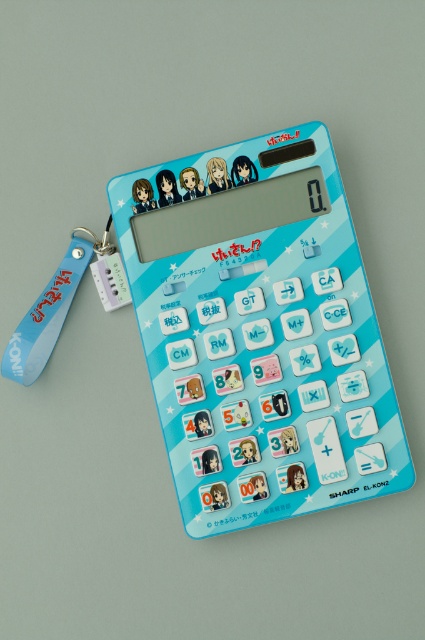
Looking at this image, does blue plastic calculator at center have a greater width compared to blue rubber lanyard at lower left?

Yes, blue plastic calculator at center is wider than blue rubber lanyard at lower left.

Does point (272, 144) come in front of point (25, 376)?

Yes, it is in front of point (25, 376).

You are a GUI agent. You are given a task and a screenshot of the screen. Output one action in this format:
    pyautogui.click(x=<x>, y=<y>)
    Task: Click on the blue plastic calculator at center
    The width and height of the screenshot is (425, 640).
    Given the screenshot: What is the action you would take?
    pyautogui.click(x=260, y=332)

This screenshot has width=425, height=640. Identify the location of blue plastic calculator at center. (260, 332).